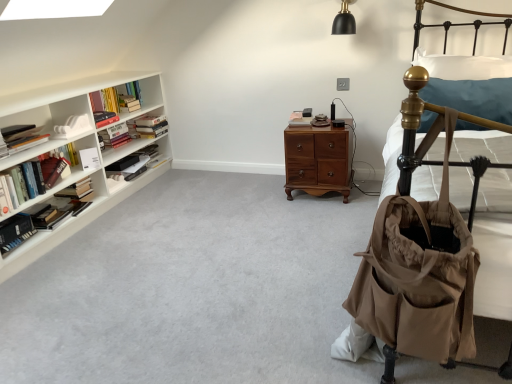
Question: Relative to white soft pillow at upper right, is hardcover book at left, which is counted as the 7th book, starting from the right, in front or behind?

Choices:
 (A) front
 (B) behind

Answer: (B)

Question: From the image's perspective, is hardcover book at left, which ranks as the fourth book in left-to-right order, positioned above or below white soft pillow at upper right?

Choices:
 (A) below
 (B) above

Answer: (A)

Question: Which object is the farthest from the white matte book at center, which ranks as the tenth book in left-to-right order?

Choices:
 (A) hardcover book at left, the 8th book viewed from the left
 (B) brown wood nightstand at center
 (C) hardcover book at left, which ranks as the 4th book in right-to-left order
 (D) hardcover book at left, which is counted as the 7th book, starting from the right
 (E) hardcover book at left, marked as the 1th book in a left-to-right arrangement

Answer: (E)

Question: Which is farther from the hardcover books at left, positioned as the second book in right-to-left order?

Choices:
 (A) brown wood nightstand at center
 (B) hardcover book at left, the tenth book positioned from the right
 (C) tan fabric baby carriage at right
 (D) hardcover book at left, which ranks as the 4th book in right-to-left order
 (E) hardcover book at left, the 3th book from the left

Answer: (C)